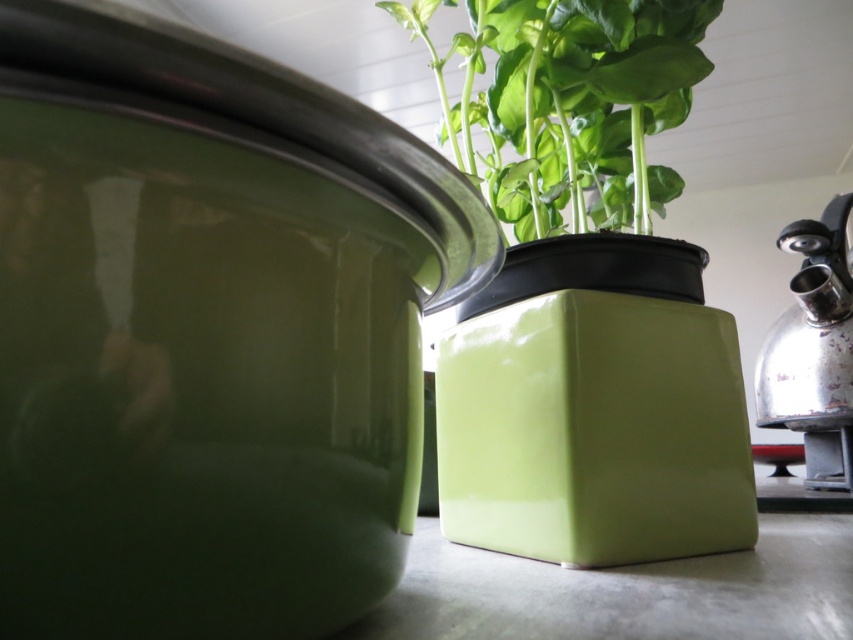
Is green glossy plant at center taller than shiny metallic kettle at right?

No.

Image resolution: width=853 pixels, height=640 pixels. I want to click on green glossy plant at center, so click(569, 104).

Describe the element at coordinates (569, 104) in the screenshot. The width and height of the screenshot is (853, 640). I see `green glossy plant at center` at that location.

Find the location of a particular element. The image size is (853, 640). green glossy plant at center is located at coordinates (569, 104).